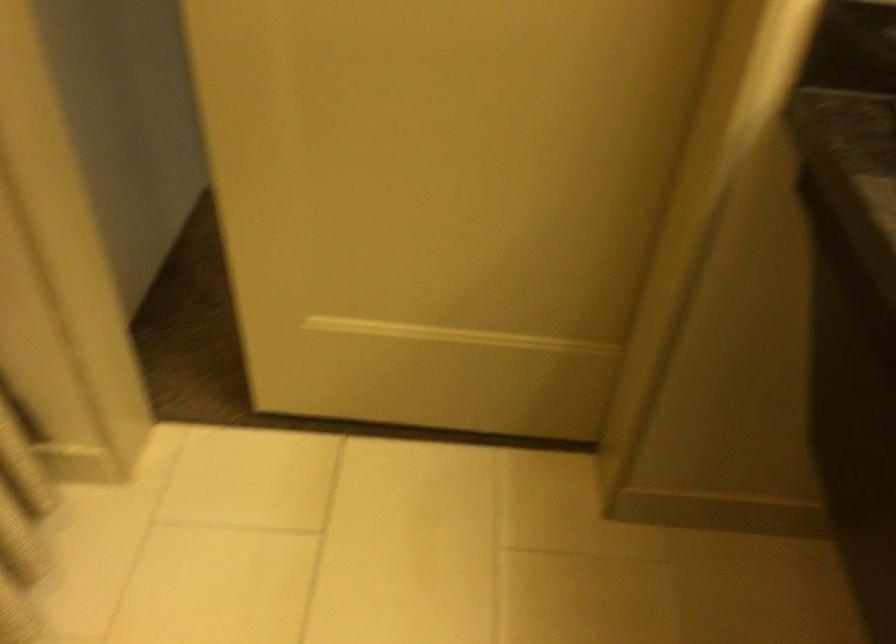
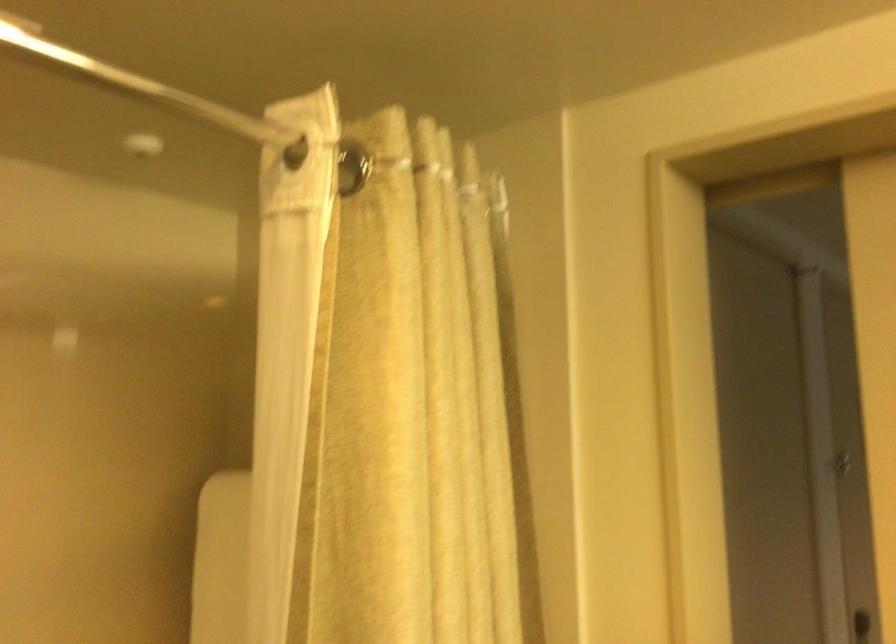
Based on the continuous images, in which direction is the camera rotating?

The camera rotated toward left-up.